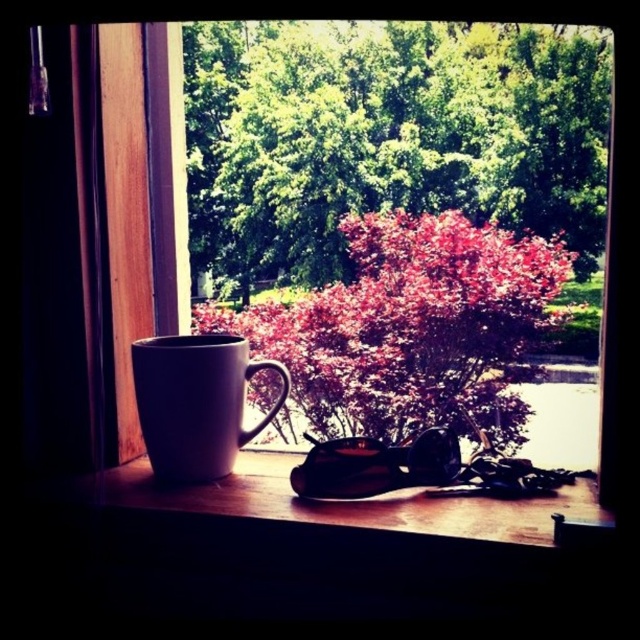
Consider the image. Does green leafy tree at upper center have a greater width compared to white matte mug at left?

Indeed, green leafy tree at upper center has a greater width compared to white matte mug at left.

Is green leafy tree at upper center positioned before white matte mug at left?

That is False.

Where is `green leafy tree at upper center`? This screenshot has width=640, height=640. green leafy tree at upper center is located at coordinates (387, 136).

Locate an element on the screen. The width and height of the screenshot is (640, 640). green leafy tree at upper center is located at coordinates (387, 136).

Which of these two, matte red bush at center or wooden at lower center, stands shorter?

With less height is wooden at lower center.

Measure the distance from matte red bush at center to wooden at lower center.

A distance of 18.78 inches exists between matte red bush at center and wooden at lower center.

This screenshot has width=640, height=640. In order to click on matte red bush at center in this screenshot , I will do coord(413,328).

Does green leafy tree at upper center appear on the left side of matte red bush at center?

In fact, green leafy tree at upper center is to the right of matte red bush at center.

Which is more to the right, green leafy tree at upper center or matte red bush at center?

From the viewer's perspective, green leafy tree at upper center appears more on the right side.

Between point (308, 54) and point (554, 326), which one is positioned in front?

Point (554, 326) is in front.

The height and width of the screenshot is (640, 640). In order to click on green leafy tree at upper center in this screenshot , I will do `click(387, 136)`.